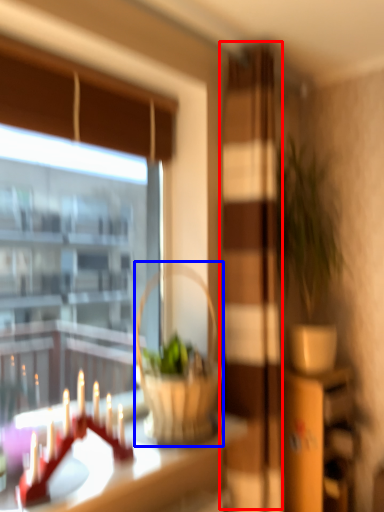
Question: Which object appears closest to the camera in this image, screen door (highlighted by a red box) or picnic basket (highlighted by a blue box)?

Choices:
 (A) screen door
 (B) picnic basket

Answer: (B)